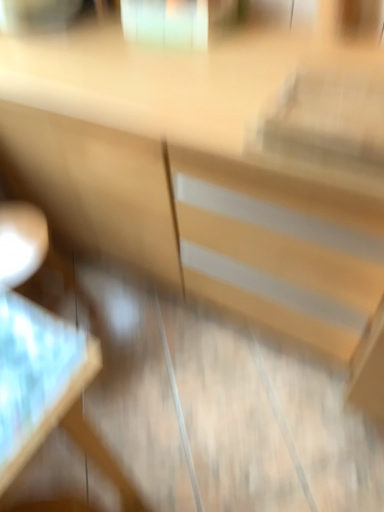
This screenshot has height=512, width=384. What do you see at coordinates (37, 377) in the screenshot?
I see `wooden table at lower left` at bounding box center [37, 377].

The width and height of the screenshot is (384, 512). Identify the location of wooden table at lower left. (37, 377).

Locate an element on the screen. wooden table at lower left is located at coordinates (37, 377).